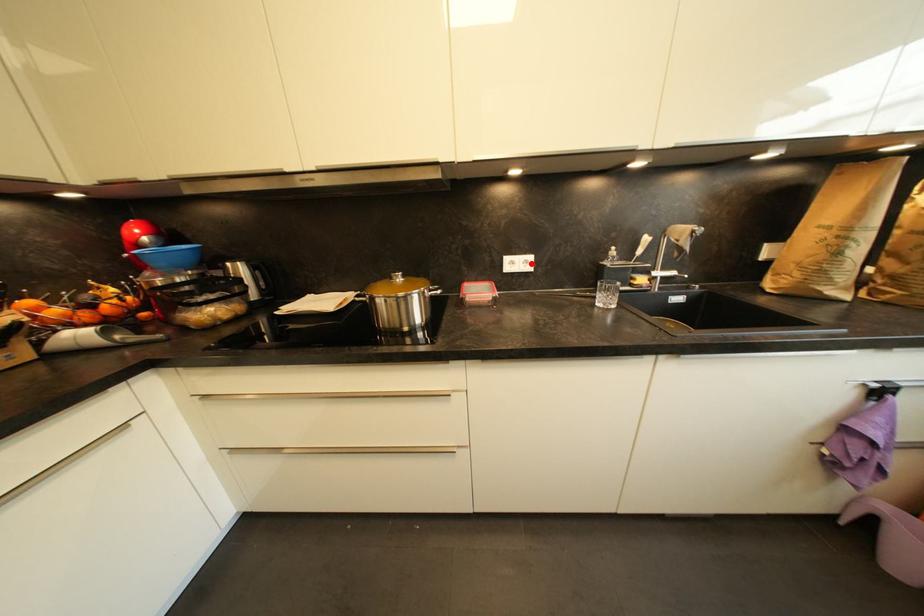
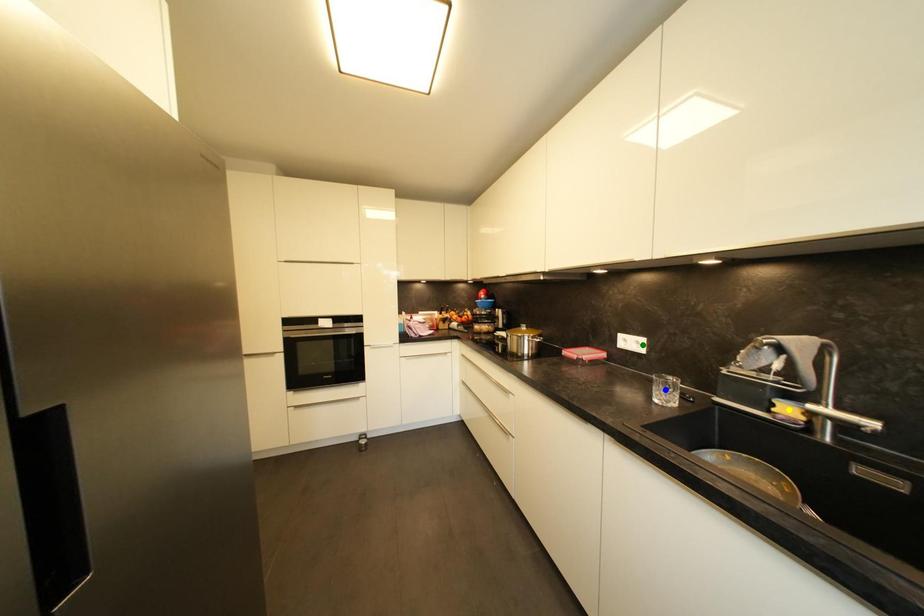
Question: I am providing you with two images of the same scene from different viewpoints. A red point is marked on the first image. You are given multiple points on the second image. Which point in image 2 represents the same 3d spot as the red point in image 1?

Choices:
 (A) blue point
 (B) yellow point
 (C) green point

Answer: (C)